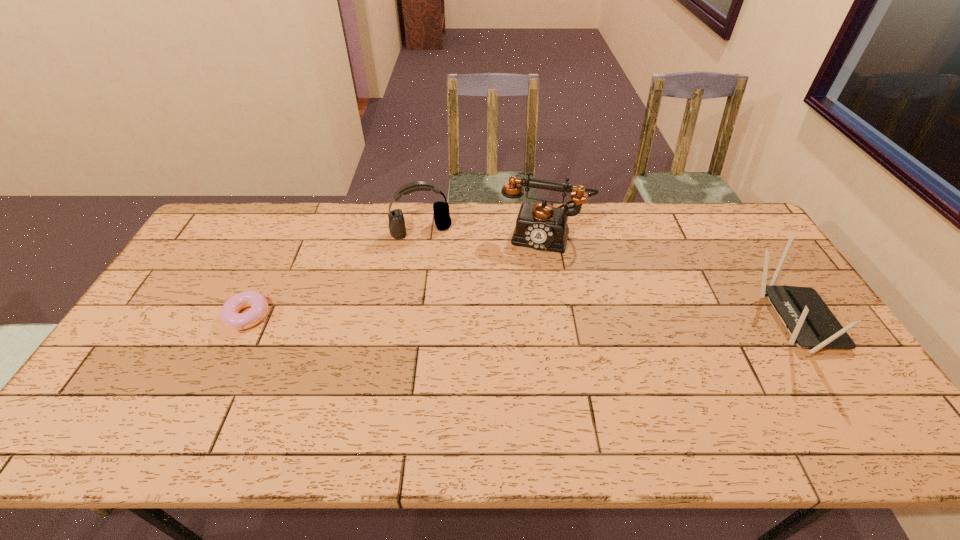
Find the location of a particular element. The height and width of the screenshot is (540, 960). free space on the desktop that is between the leftmost object and the rightmost object and is positioned on the front of the telephone at the rotary dial is located at coordinates (524, 319).

Locate an element on the screen. Image resolution: width=960 pixels, height=540 pixels. vacant spot on the desktop that is between the doughnut and the rightmost object and is positioned on the headband of the headset is located at coordinates (450, 318).